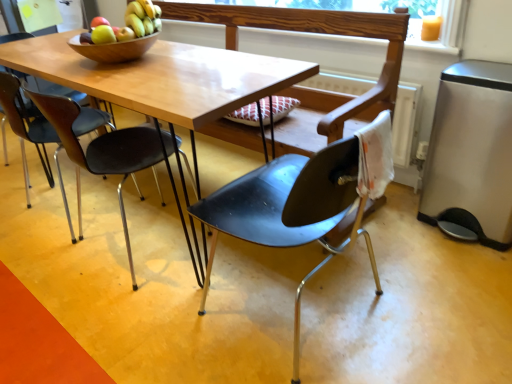
You are a GUI agent. You are given a task and a screenshot of the screen. Output one action in this format:
    pyautogui.click(x=<x>, y=<y>)
    Task: Click on the vacant area that lies to the right of matte black chair at center, acting as the 1th chair starting from the right
    The image size is (512, 384).
    Given the screenshot: What is the action you would take?
    pyautogui.click(x=422, y=290)